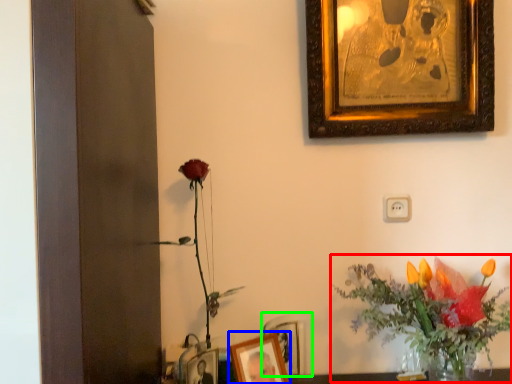
Question: Based on their relative distances, which object is farther from floral arrangement (highlighted by a red box)? Choose from picture frame (highlighted by a blue box) and picture frame (highlighted by a green box).

Choices:
 (A) picture frame
 (B) picture frame

Answer: (A)